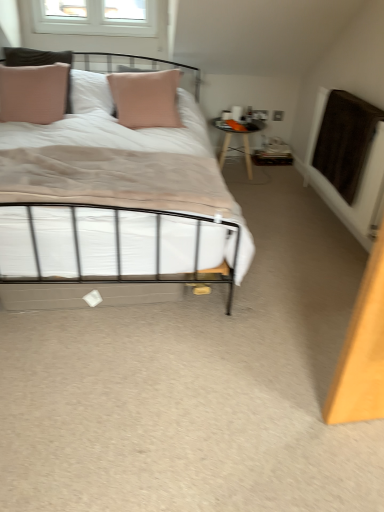
The width and height of the screenshot is (384, 512). I want to click on empty space that is to the right of wooden table at right, so click(x=279, y=179).